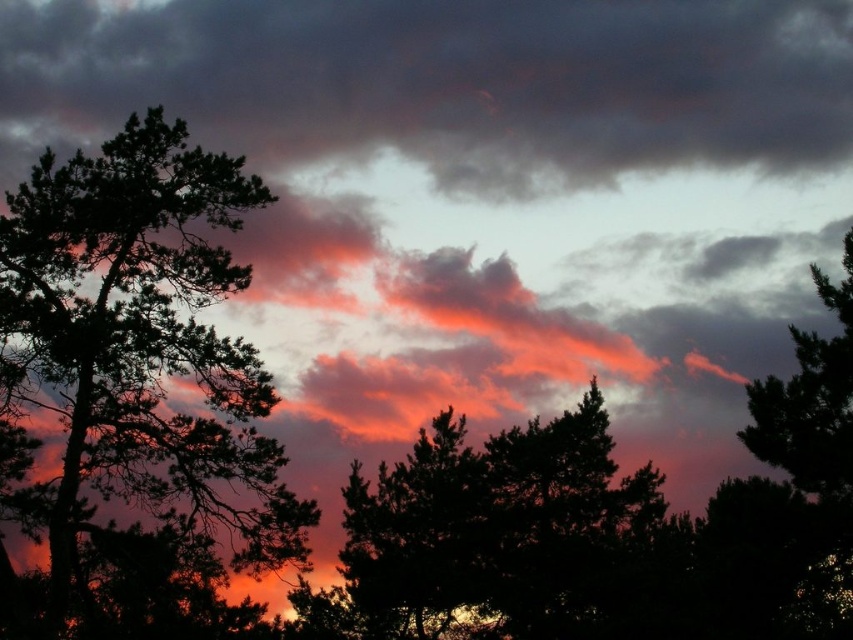
Question: Can you confirm if dark gray cloud at upper center is positioned to the right of silhouette tree at left?

Choices:
 (A) yes
 (B) no

Answer: (A)

Question: Which point is farther to the camera?

Choices:
 (A) (372, 13)
 (B) (265, 385)

Answer: (A)

Question: Can you confirm if dark gray cloud at upper center is positioned to the right of silhouette tree at left?

Choices:
 (A) yes
 (B) no

Answer: (A)

Question: Is dark gray cloud at upper center closer to camera compared to silhouette tree at left?

Choices:
 (A) no
 (B) yes

Answer: (A)

Question: Which object is closer to the camera taking this photo?

Choices:
 (A) dark gray cloud at upper center
 (B) silhouette tree at left

Answer: (B)